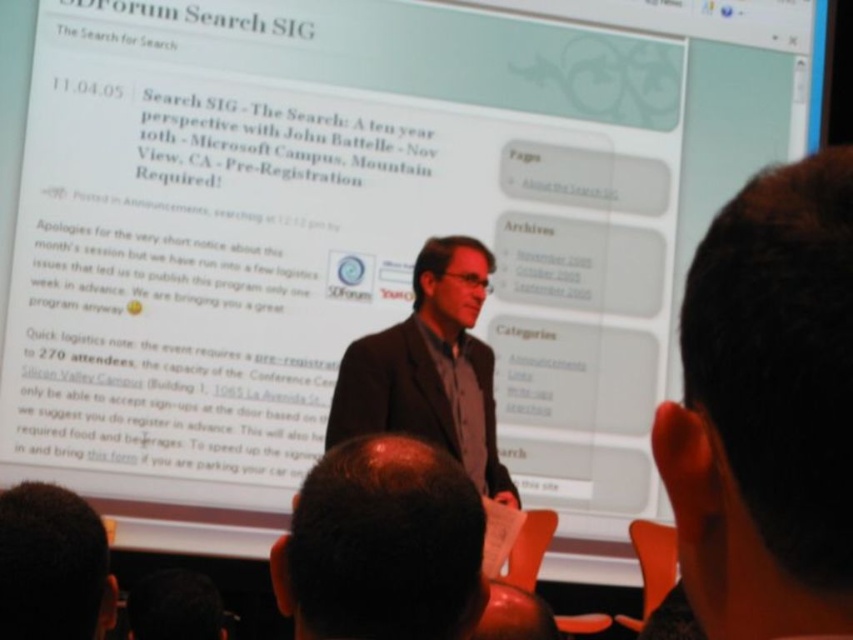
Question: Among these points, which one is nearest to the camera?

Choices:
 (A) (15, 625)
 (B) (468, 426)
 (C) (709, 248)

Answer: (C)

Question: Which object is farther from the camera taking this photo?

Choices:
 (A) dark gray suit at center
 (B) dark brown hair at center
 (C) dark brown hair at lower left
 (D) brown hair at center

Answer: (A)

Question: Is dark brown hair at upper right closer to the viewer compared to brown hair at center?

Choices:
 (A) yes
 (B) no

Answer: (A)

Question: Does dark brown hair at center appear on the left side of dark brown hair at lower left?

Choices:
 (A) no
 (B) yes

Answer: (A)

Question: Is brown hair at center closer to the viewer compared to dark brown hair at lower left?

Choices:
 (A) no
 (B) yes

Answer: (B)

Question: Which point is closer to the camera?

Choices:
 (A) (316, 538)
 (B) (432, 340)
 (C) (9, 547)
 (D) (132, 593)

Answer: (A)